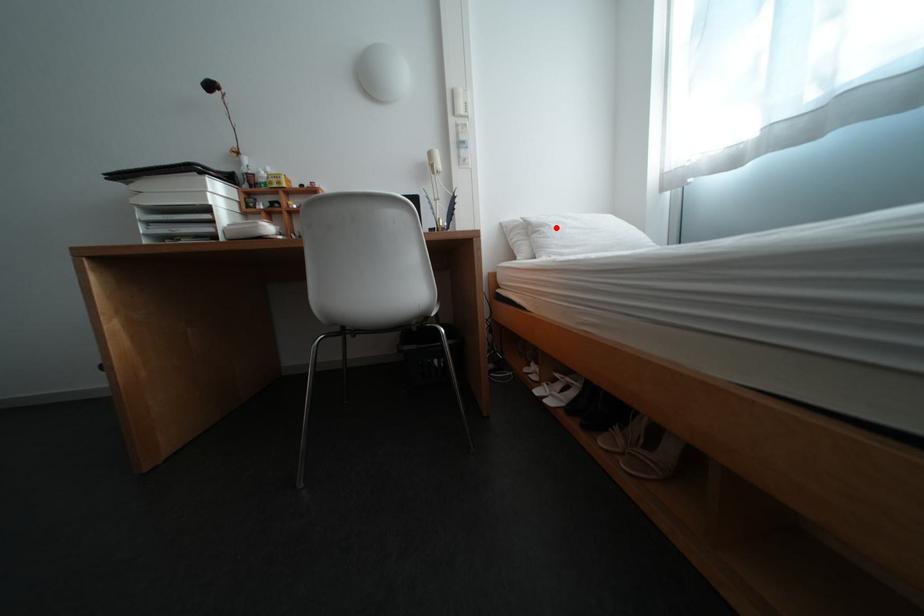
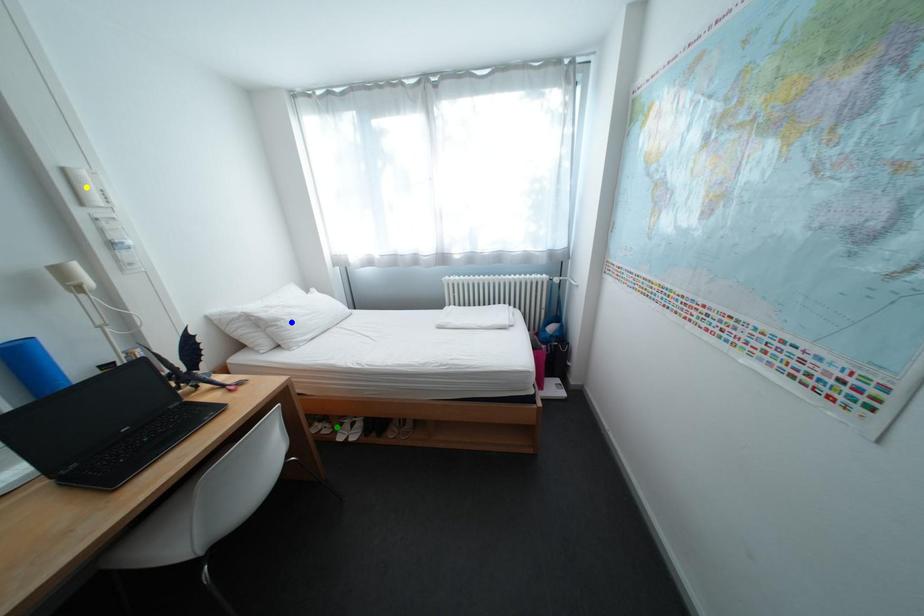
Question: I am providing you with two images of the same scene from different viewpoints. A red point is marked on the first image. You are given multiple points on the second image. Can you choose the point in image 2 that corresponds to the point in image 1?

Choices:
 (A) green point
 (B) blue point
 (C) yellow point

Answer: (B)